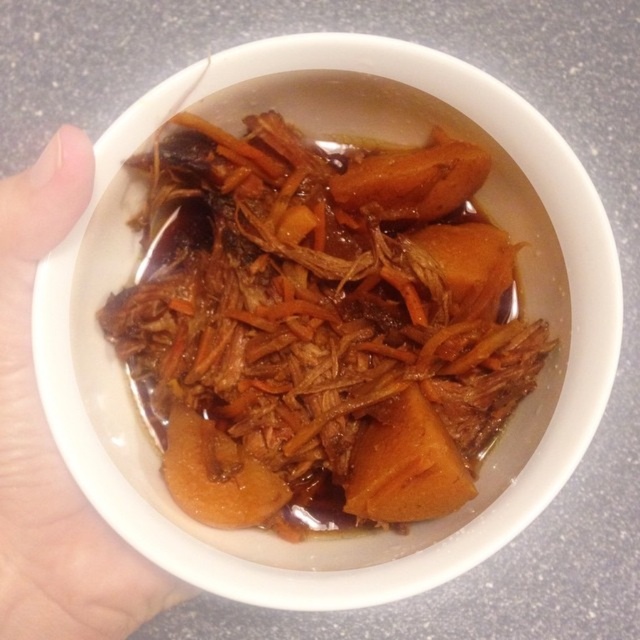
Question: Where is brown glossy shredded meat at center located in relation to skinny flesh at lower left in the image?

Choices:
 (A) above
 (B) below

Answer: (A)

Question: In this image, where is brown glossy shredded meat at center located relative to skinny flesh at lower left?

Choices:
 (A) above
 (B) below

Answer: (A)

Question: Which point is farther to the camera?

Choices:
 (A) (138, 576)
 (B) (353, 400)

Answer: (B)

Question: Observing the image, what is the correct spatial positioning of brown glossy shredded meat at center in reference to skinny flesh at lower left?

Choices:
 (A) left
 (B) right

Answer: (B)

Question: Which point is closer to the camera taking this photo?

Choices:
 (A) (74, 516)
 (B) (433, 269)

Answer: (A)

Question: Which object is closer to the camera taking this photo?

Choices:
 (A) brown glossy shredded meat at center
 (B) skinny flesh at lower left

Answer: (B)